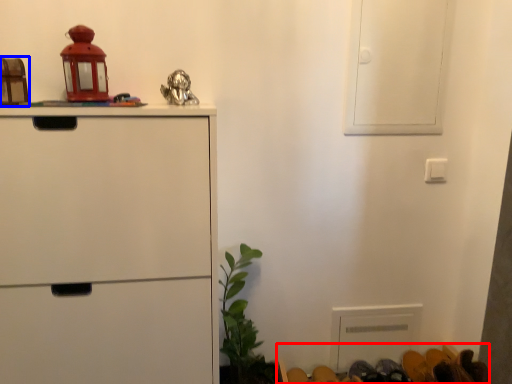
Question: Which object is closer to the camera taking this photo, furniture (highlighted by a red box) or toy (highlighted by a blue box)?

Choices:
 (A) furniture
 (B) toy

Answer: (B)